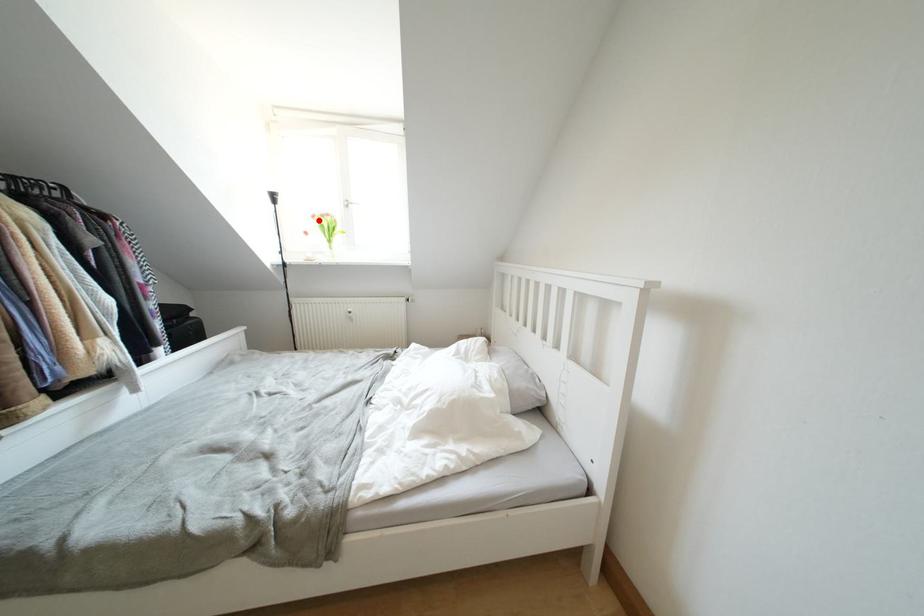
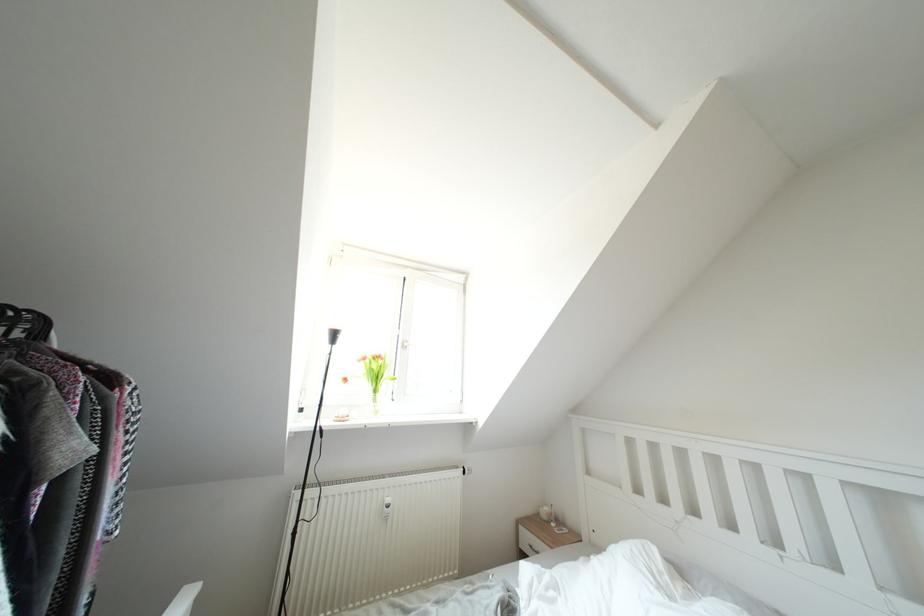
Question: I am providing you with two images of the same scene from different viewpoints. Image1 has a red point marked. In image2, the corresponding 3D location appears at what relative position? Reply with the corresponding letter.

Choices:
 (A) Closer
 (B) Farther

Answer: (B)